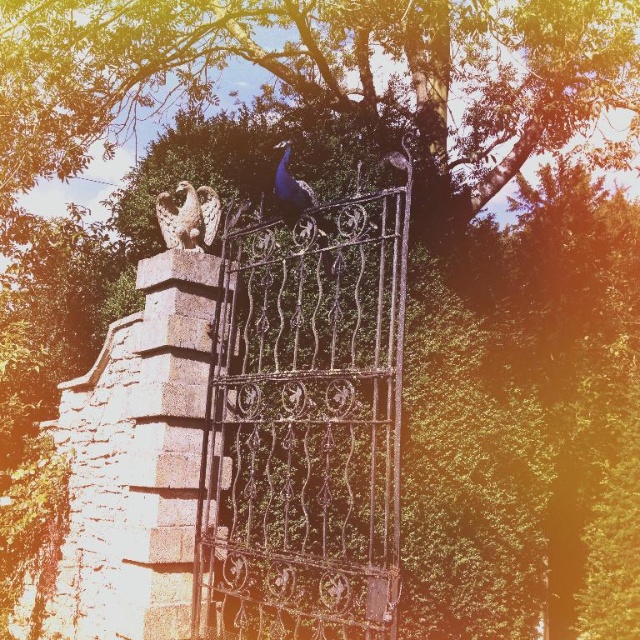
Question: Based on their relative distances, which object is farther from the stone eagle at upper center?

Choices:
 (A) shiny blue peacock at center
 (B) wrought iron gate at center

Answer: (B)

Question: Is stone eagle at upper center behind shiny blue peacock at center?

Choices:
 (A) no
 (B) yes

Answer: (B)

Question: Which of the following is the closest to the observer?

Choices:
 (A) shiny blue peacock at center
 (B) wrought iron gate at center
 (C) stone eagle at upper center

Answer: (B)

Question: Is wrought iron gate at center positioned before stone eagle at upper center?

Choices:
 (A) no
 (B) yes

Answer: (B)

Question: Is the position of wrought iron gate at center more distant than that of stone eagle at upper center?

Choices:
 (A) yes
 (B) no

Answer: (B)

Question: Which point is farther from the camera taking this photo?

Choices:
 (A) (285, 362)
 (B) (189, 241)
 (C) (330, 225)

Answer: (B)